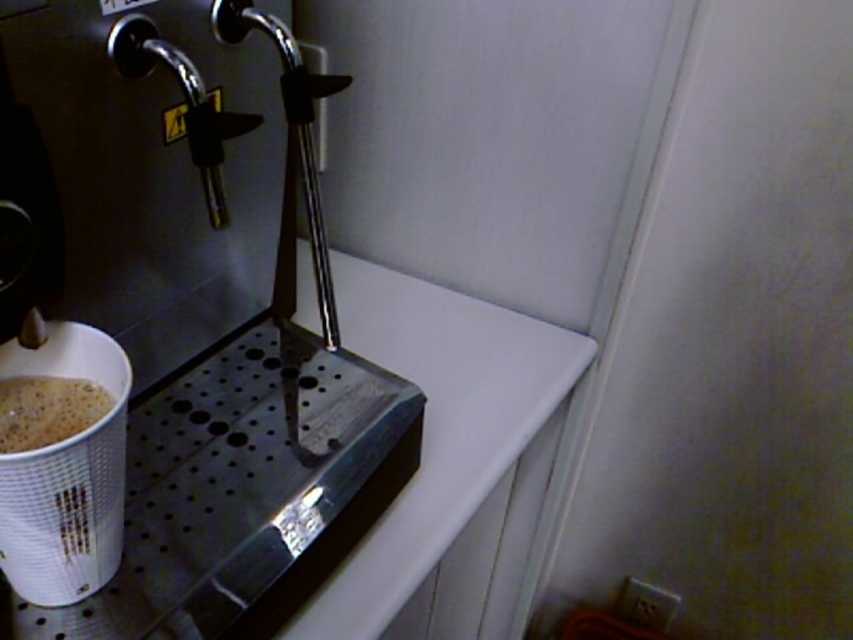
Which is in front, point (109, 576) or point (9, 380)?

Positioned in front is point (9, 380).

Who is positioned more to the left, white paper cup at lower left or foamy white coffee at lower left?

From the viewer's perspective, foamy white coffee at lower left appears more on the left side.

The height and width of the screenshot is (640, 853). Describe the element at coordinates (65, 476) in the screenshot. I see `white paper cup at lower left` at that location.

This screenshot has width=853, height=640. I want to click on white paper cup at lower left, so click(x=65, y=476).

Does metallic silver coffee machine at left come in front of white paper cup at lower left?

That is False.

Looking at this image, who is shorter, metallic silver coffee machine at left or white paper cup at lower left?

Standing shorter between the two is white paper cup at lower left.

Describe the element at coordinates (190, 324) in the screenshot. I see `metallic silver coffee machine at left` at that location.

Locate an element on the screen. The image size is (853, 640). metallic silver coffee machine at left is located at coordinates (190, 324).

Is metallic silver coffee machine at left thinner than foamy white coffee at lower left?

Incorrect, metallic silver coffee machine at left's width is not less than foamy white coffee at lower left's.

Which is below, metallic silver coffee machine at left or foamy white coffee at lower left?

foamy white coffee at lower left is below.

The width and height of the screenshot is (853, 640). Describe the element at coordinates (190, 324) in the screenshot. I see `metallic silver coffee machine at left` at that location.

Where is `metallic silver coffee machine at left`? The image size is (853, 640). metallic silver coffee machine at left is located at coordinates (190, 324).